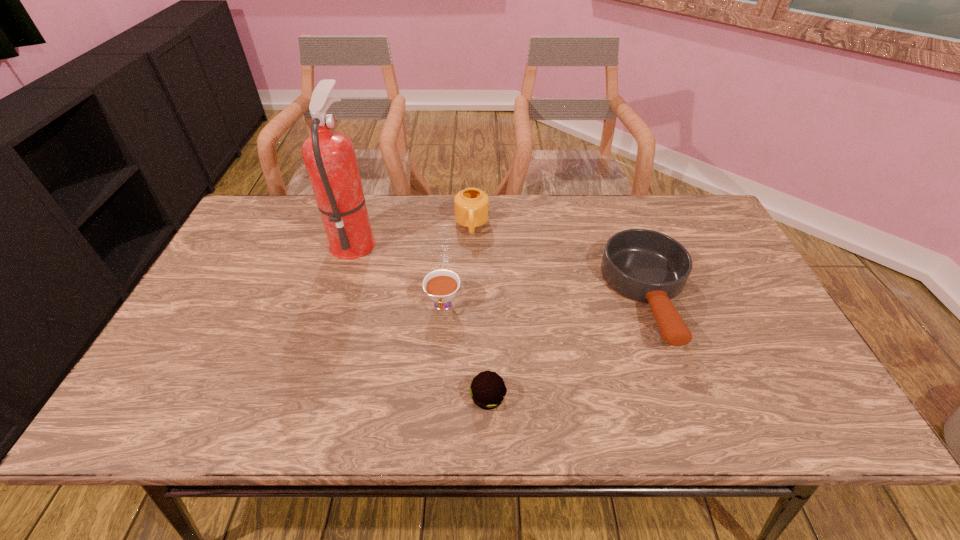
Locate an element on the screen. The width and height of the screenshot is (960, 540). the leftmost object is located at coordinates (329, 156).

This screenshot has width=960, height=540. Find the location of `the tallest object`. the tallest object is located at coordinates (329, 156).

Image resolution: width=960 pixels, height=540 pixels. In order to click on the second tallest object in this screenshot , I will do `click(471, 205)`.

Where is `the rightmost object`? This screenshot has height=540, width=960. the rightmost object is located at coordinates (644, 265).

This screenshot has width=960, height=540. Find the location of `teacup`. teacup is located at coordinates (441, 286).

You are a GUI agent. You are given a task and a screenshot of the screen. Output one action in this format:
    pyautogui.click(x=<x>, y=<y>)
    Task: Click on the patty
    This screenshot has width=960, height=540.
    Given the screenshot: What is the action you would take?
    pyautogui.click(x=487, y=389)

Identify the location of the nearest object. This screenshot has height=540, width=960. (487, 389).

Where is `vacant space located with the handle and hose on the tallest object`? The height and width of the screenshot is (540, 960). vacant space located with the handle and hose on the tallest object is located at coordinates (505, 240).

I want to click on vacant region located on the handle side of the mug, so 471,254.

At what (x,y) coordinates should I click in order to perform the action: click on vacant area situated 0.070m on the handle side of the pan. Please return your answer as a coordinate pair (x, y). The height and width of the screenshot is (540, 960). Looking at the image, I should click on (682, 385).